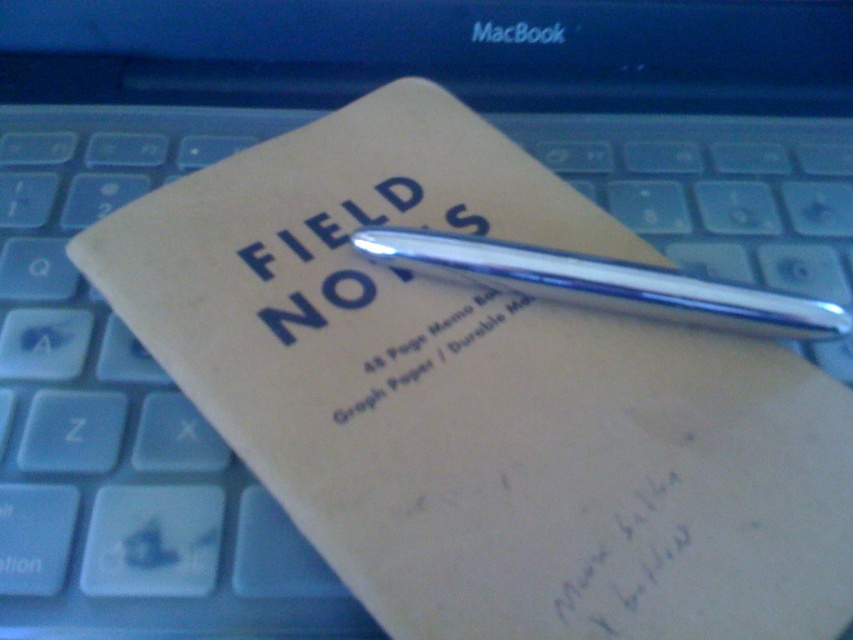
Question: Among these points, which one is farthest from the camera?

Choices:
 (A) (409, 193)
 (B) (445, 257)
 (C) (647, 609)

Answer: (A)

Question: Is matte black text at center bigger than silver metallic pen at center?

Choices:
 (A) no
 (B) yes

Answer: (A)

Question: Estimate the real-world distances between objects in this image. Which object is closer to the matte black text at center?

Choices:
 (A) silver metallic pen at center
 (B) chrome metallic pen at center
 (C) white paper at center

Answer: (C)

Question: Is chrome metallic pen at center closer to camera compared to silver metallic pen at center?

Choices:
 (A) no
 (B) yes

Answer: (B)

Question: Is chrome metallic pen at center positioned before silver metallic pen at center?

Choices:
 (A) no
 (B) yes

Answer: (B)

Question: Which point appears farthest from the camera in this image?

Choices:
 (A) (351, 198)
 (B) (566, 536)
 (C) (428, 372)
 (D) (503, 244)

Answer: (A)